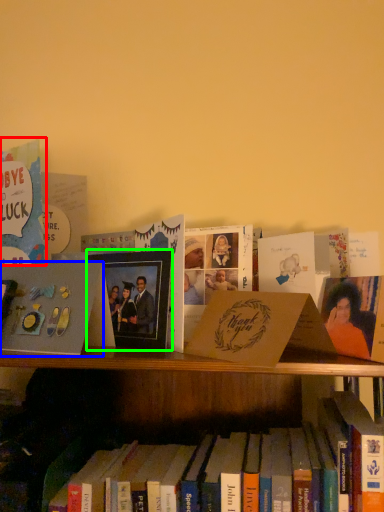
Question: Estimate the real-world distances between objects in this image. Which object is closer to book (highlighted by a red box), paperback book (highlighted by a blue box) or picture frame (highlighted by a green box)?

Choices:
 (A) paperback book
 (B) picture frame

Answer: (A)